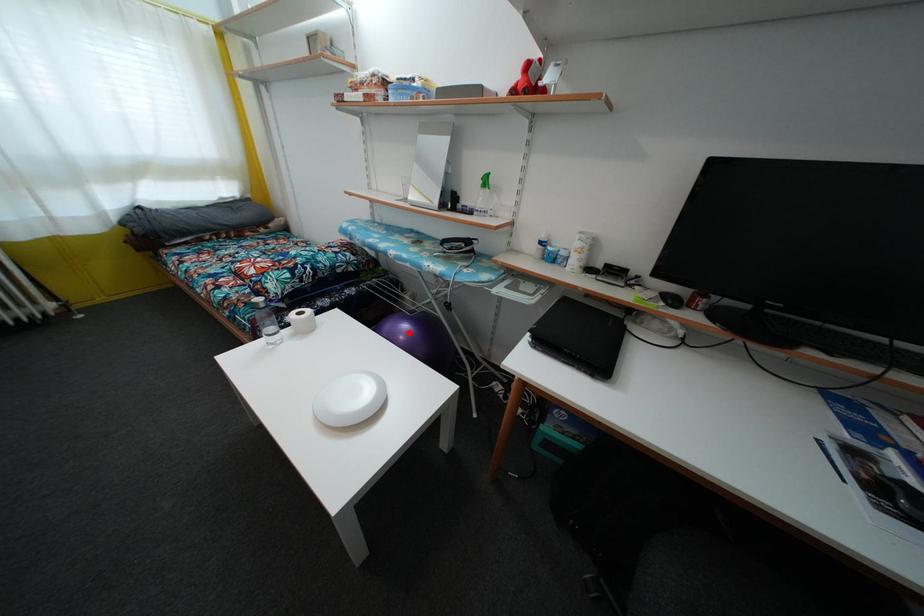
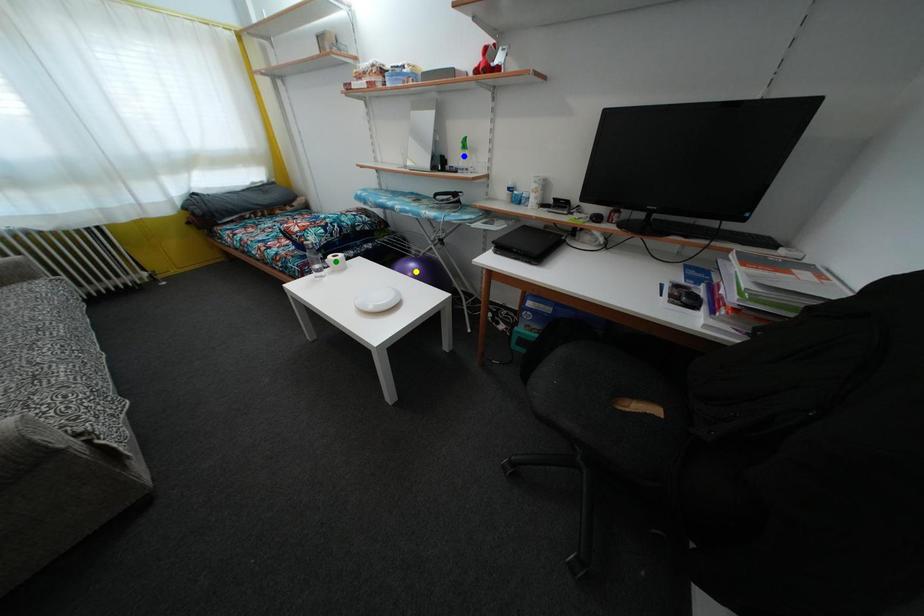
Question: I am providing you with two images of the same scene from different viewpoints. A red point is marked on the first image. You are given multiple points on the second image. In image 2, which mark is for the same physical point as the one in image 1?

Choices:
 (A) green point
 (B) blue point
 (C) yellow point

Answer: (C)